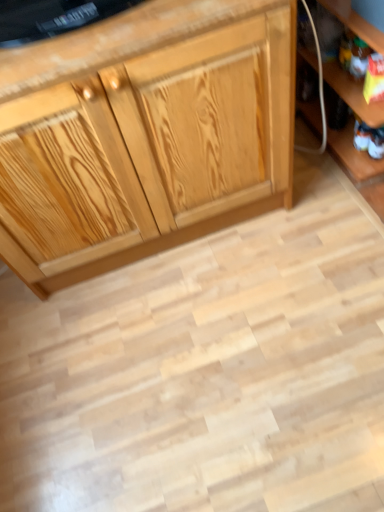
This screenshot has width=384, height=512. I want to click on free location in front of natural wood cabinet at center, so click(191, 355).